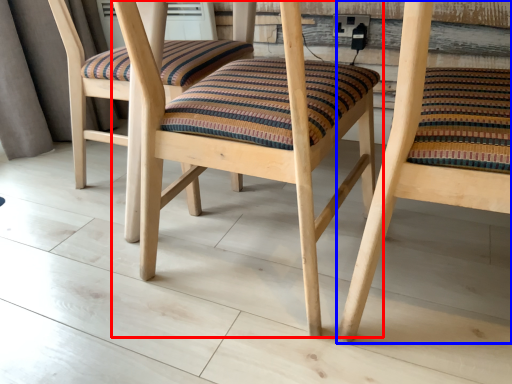
Question: Which of the following is the farthest to the observer, chair (highlighted by a red box) or chair (highlighted by a blue box)?

Choices:
 (A) chair
 (B) chair

Answer: (A)